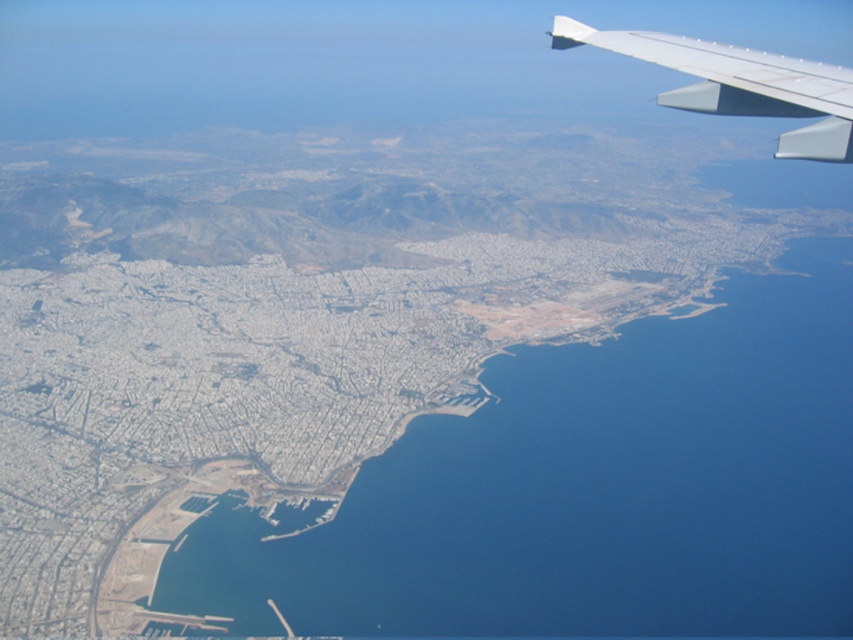
Question: Is blue water at lower left thinner than white matte wing at upper right?

Choices:
 (A) yes
 (B) no

Answer: (B)

Question: Among these points, which one is nearest to the camera?

Choices:
 (A) (836, 154)
 (B) (808, 579)

Answer: (A)

Question: Can you confirm if blue water at lower left is positioned below white matte wing at upper right?

Choices:
 (A) no
 (B) yes

Answer: (B)

Question: Does blue water at lower left have a lesser width compared to white matte wing at upper right?

Choices:
 (A) no
 (B) yes

Answer: (A)

Question: Which point is farther from the camera taking this photo?

Choices:
 (A) (561, 499)
 (B) (675, 68)

Answer: (A)